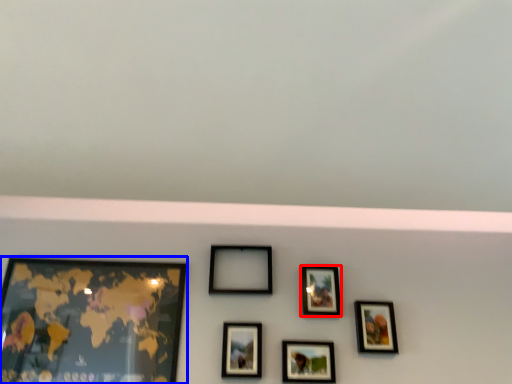
Question: Which object is closer to the camera taking this photo, picture frame (highlighted by a red box) or picture frame (highlighted by a blue box)?

Choices:
 (A) picture frame
 (B) picture frame

Answer: (B)